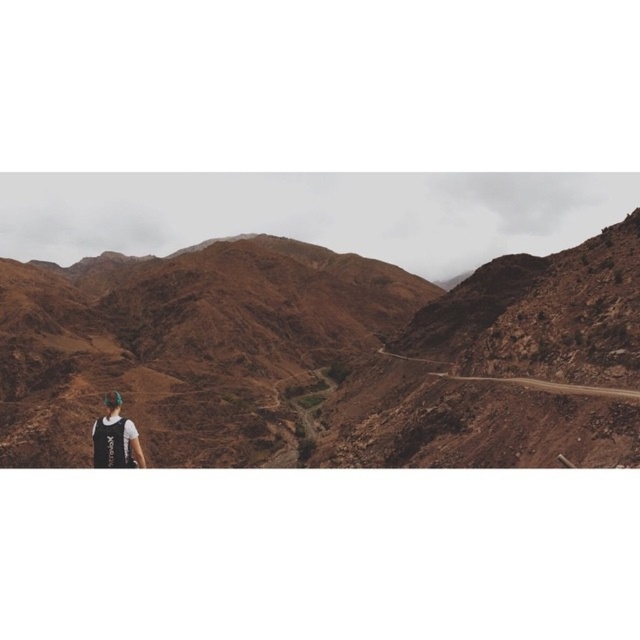
Question: Which point is farther to the camera?

Choices:
 (A) black fabric backpack at lower left
 (B) dirt road at center
 (C) brown rocky mountain at center

Answer: (B)

Question: Can you confirm if brown rocky mountain at center is positioned below black fabric backpack at lower left?

Choices:
 (A) no
 (B) yes

Answer: (A)

Question: Observing the image, what is the correct spatial positioning of brown rocky mountain at center in reference to dirt road at center?

Choices:
 (A) right
 (B) left

Answer: (B)

Question: Considering the real-world distances, which object is closest to the black fabric backpack at lower left?

Choices:
 (A) brown rocky mountain at center
 (B) dirt road at center

Answer: (B)

Question: Which object is positioned closest to the dirt road at center?

Choices:
 (A) black fabric backpack at lower left
 (B) brown rocky mountain at center

Answer: (A)

Question: Can you confirm if black fabric backpack at lower left is smaller than dirt road at center?

Choices:
 (A) no
 (B) yes

Answer: (A)